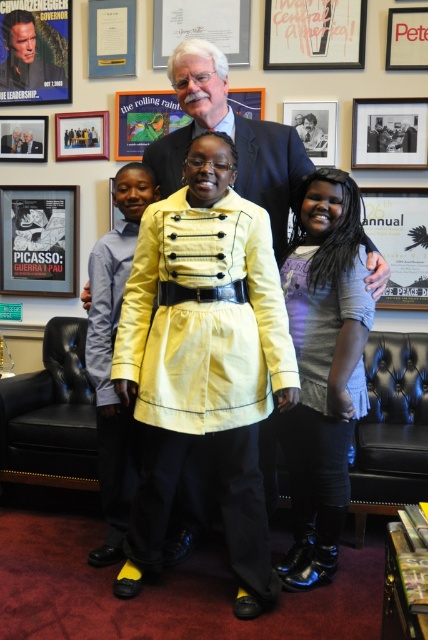
Looking at the scene, where is the metallic poster at upper left in relation to the matte paper document at upper center?

The metallic poster at upper left is positioned below the matte paper document at upper center.

Looking at the framed certificates and posters on the wall behind the group, which object is bigger between the metallic poster at upper left and the matte paper document at upper center?

The metallic poster at upper left is larger in size compared to the matte paper document at upper center.